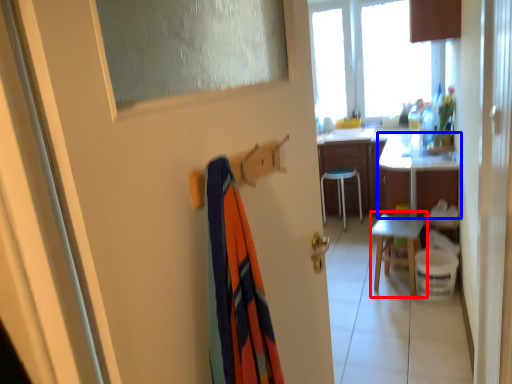
Question: Which object is closer to the camera taking this photo, chair (highlighted by a red box) or desk (highlighted by a blue box)?

Choices:
 (A) chair
 (B) desk

Answer: (A)